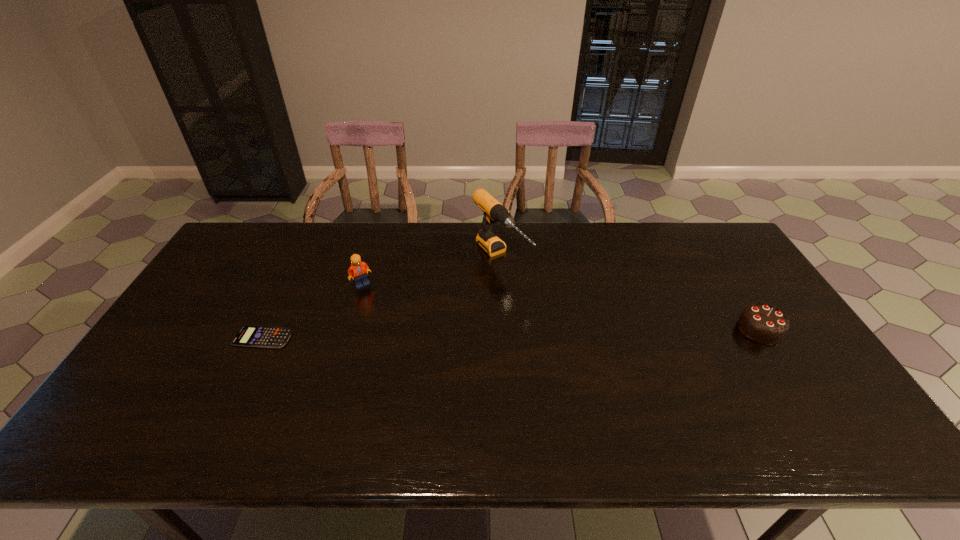
Locate an element on the screen. free space located on the front-facing side of the second object from left to right is located at coordinates (449, 338).

Locate an element on the screen. The height and width of the screenshot is (540, 960). vacant space located on the front-facing side of the second object from left to right is located at coordinates (405, 310).

Identify the location of free spot located 0.380m on the front-facing side of the second object from left to right. (463, 346).

Identify the location of free spot located on the handle side of the drill. This screenshot has width=960, height=540. (573, 341).

The width and height of the screenshot is (960, 540). I want to click on free space located 0.360m on the handle side of the drill, so click(x=593, y=361).

I want to click on free point located on the handle side of the drill, so click(x=545, y=312).

Locate an element on the screen. The height and width of the screenshot is (540, 960). object that is at the far edge is located at coordinates (494, 211).

Image resolution: width=960 pixels, height=540 pixels. In order to click on object that is at the right edge in this screenshot , I will do `click(762, 323)`.

Image resolution: width=960 pixels, height=540 pixels. I want to click on vacant space at the far edge, so click(420, 259).

The image size is (960, 540). I want to click on vacant space at the near edge of the desktop, so click(398, 404).